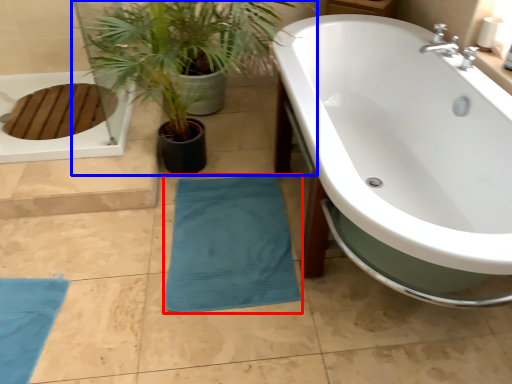
Question: Which object appears farthest to the camera in this image, beach towel (highlighted by a red box) or houseplant (highlighted by a blue box)?

Choices:
 (A) beach towel
 (B) houseplant

Answer: (A)